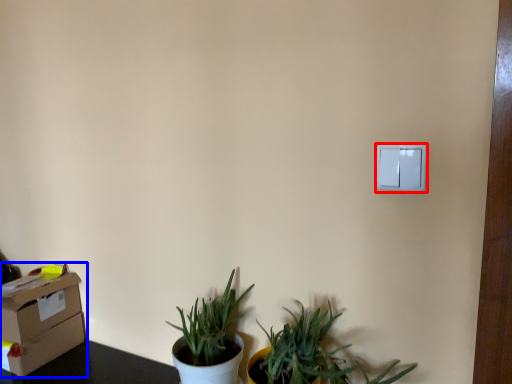
Question: Which object appears farthest to the camera in this image, light switch (highlighted by a red box) or cardboard box (highlighted by a blue box)?

Choices:
 (A) light switch
 (B) cardboard box

Answer: (B)